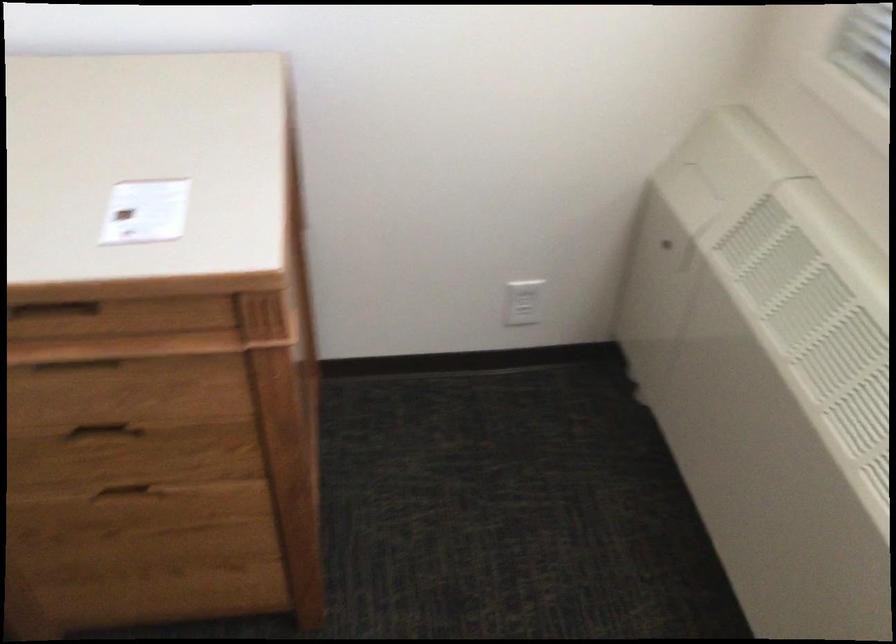
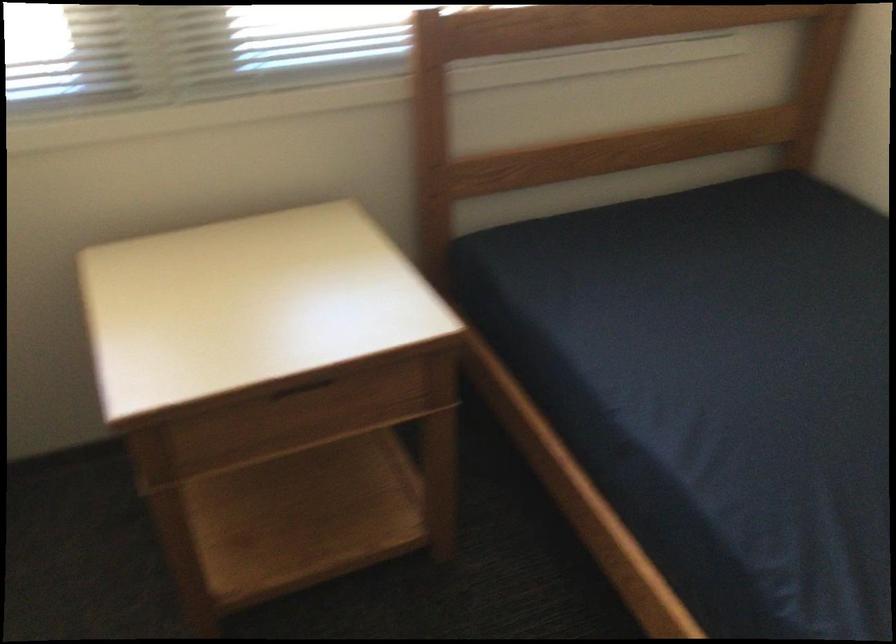
First-person continuous shooting, in which direction is the camera rotating?

The camera's rotation is toward right-down.